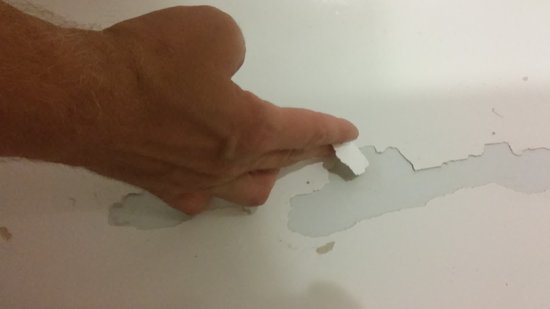
The image size is (550, 309). Identify the location of wall. (397, 79).